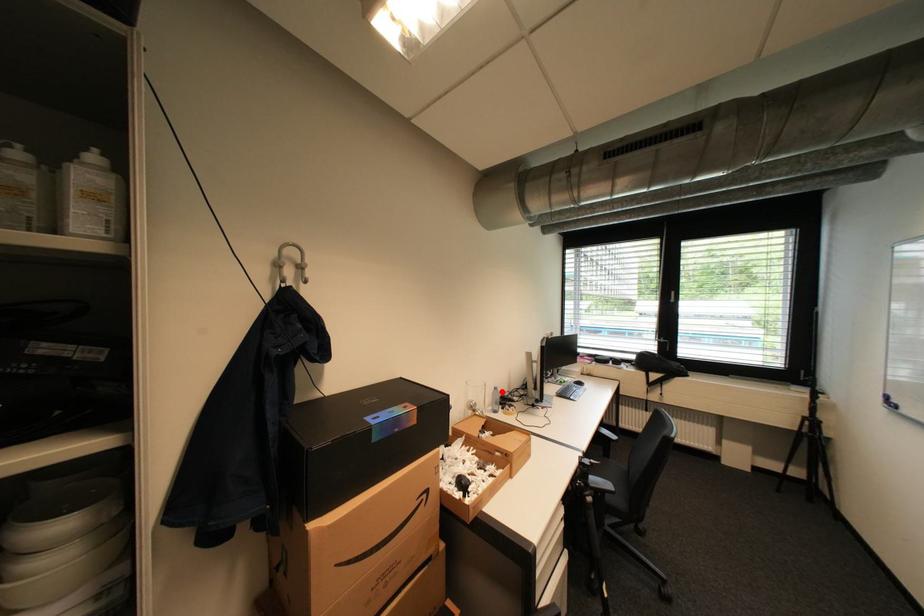
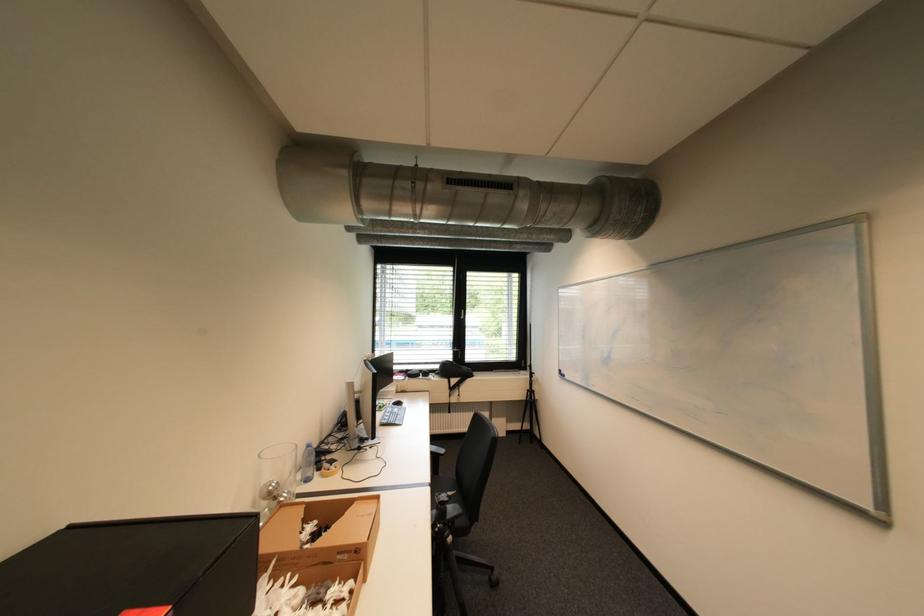
Find the pixel in the second image that matches the highlighted location in the first image.

(313, 451)